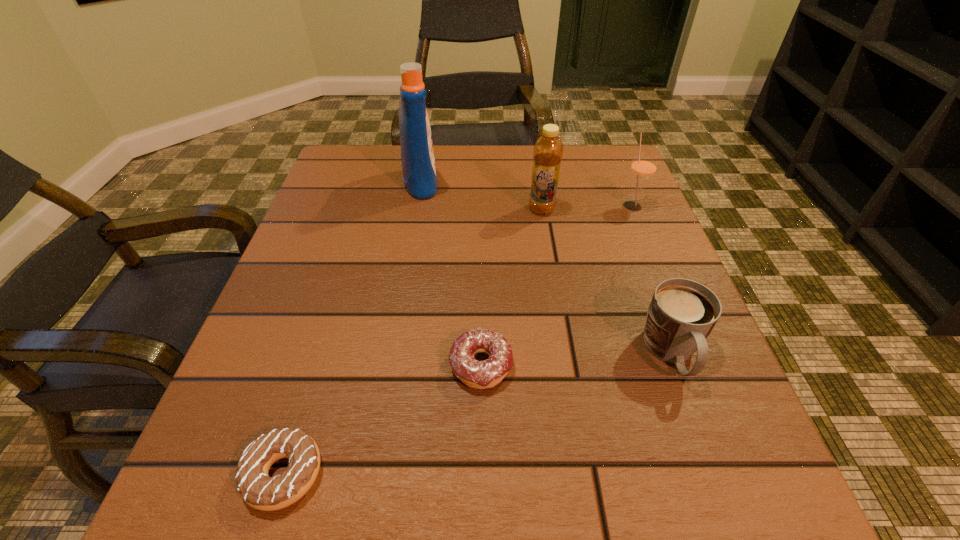
The image size is (960, 540). I want to click on the second object from left to right, so click(x=417, y=155).

I want to click on detergent, so click(417, 155).

Identify the location of the fourth object from left to right. The width and height of the screenshot is (960, 540). (548, 150).

Locate an element on the screen. the second tallest object is located at coordinates (548, 150).

You are a GUI agent. You are given a task and a screenshot of the screen. Output one action in this format:
    pyautogui.click(x=<x>, y=<y>)
    Task: Click on the fourth shortest object
    The height and width of the screenshot is (540, 960).
    Given the screenshot: What is the action you would take?
    pyautogui.click(x=643, y=167)

Identify the location of the fourth tallest object. The width and height of the screenshot is (960, 540). (682, 313).

Locate an element on the screen. the fourth object from right to left is located at coordinates (476, 374).

Identify the location of the right doughnut. (476, 374).

The image size is (960, 540). I want to click on the nearest object, so click(257, 489).

The height and width of the screenshot is (540, 960). I want to click on the left doughnut, so click(257, 489).